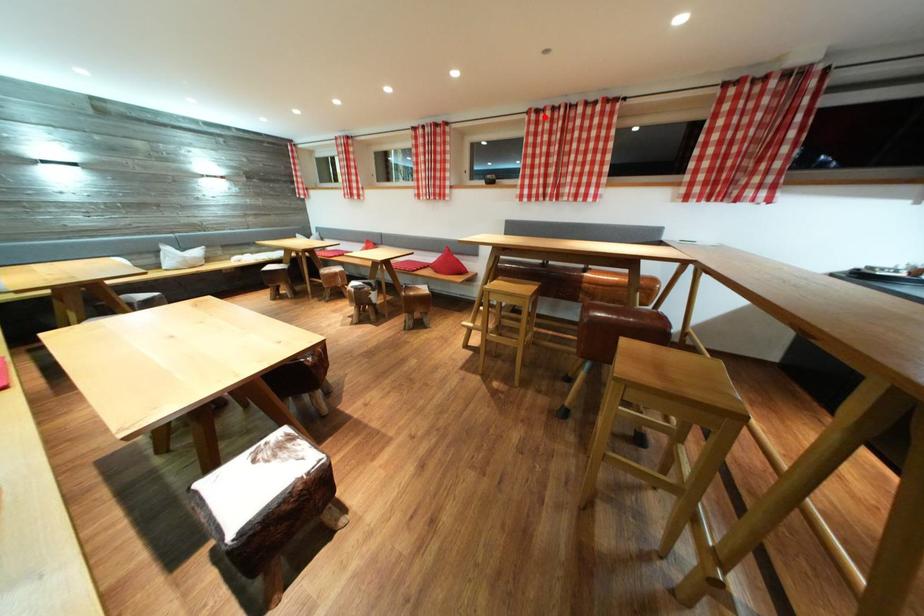
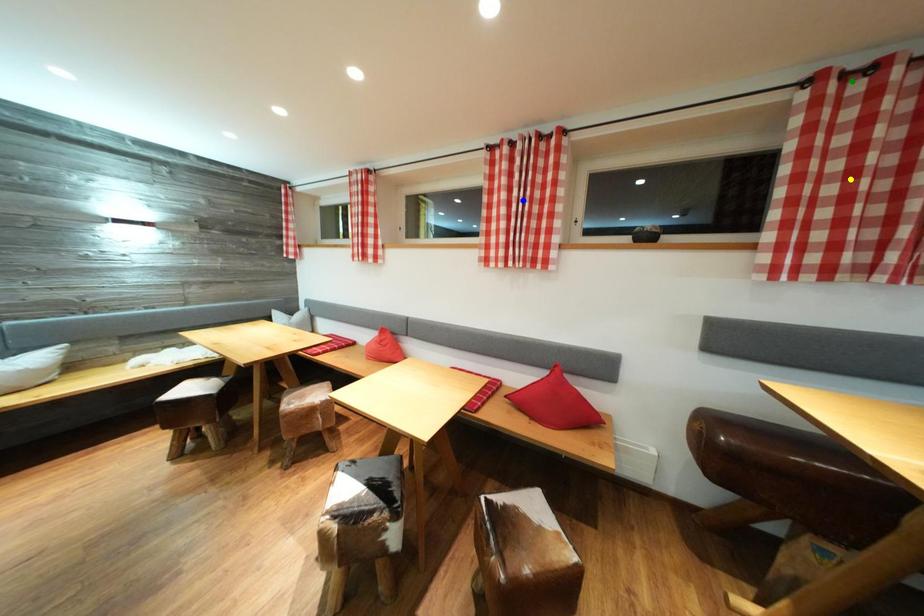
Question: I am providing you with two images of the same scene from different viewpoints. A red point is marked on the first image. You are given multiple points on the second image. Which mark in image 2 goes with the point in image 1?

Choices:
 (A) green point
 (B) yellow point
 (C) blue point

Answer: (A)